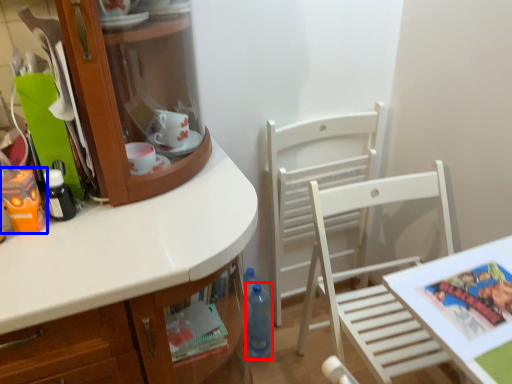
Question: Which point is closer to the camera, bottle (highlighted by a red box) or toy (highlighted by a blue box)?

Choices:
 (A) bottle
 (B) toy

Answer: (B)